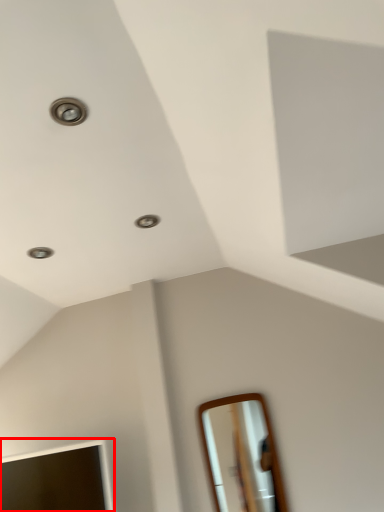
Question: From the image, what is the correct spatial relationship of mirror (annotated by the red box) in relation to mirror?

Choices:
 (A) right
 (B) left

Answer: (B)